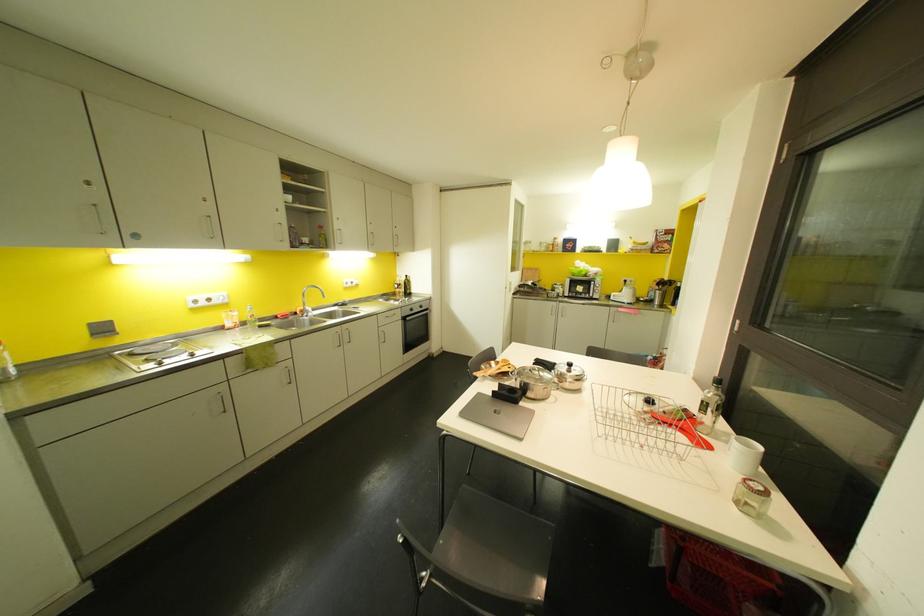
This screenshot has height=616, width=924. I want to click on pot lid handle, so click(x=570, y=366).